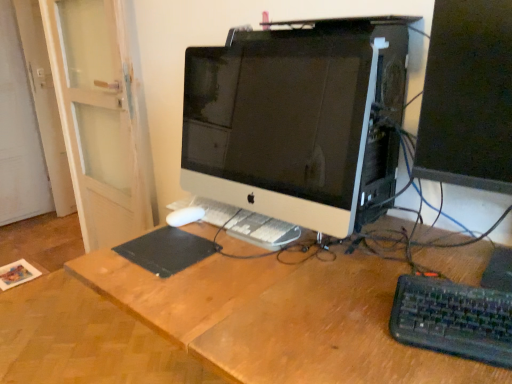
The image size is (512, 384). I want to click on vacant area that lies between white glossy computer monitor at center, which is counted as the 2th computer monitor, starting from the right, and black matte mousepad at center, so click(251, 268).